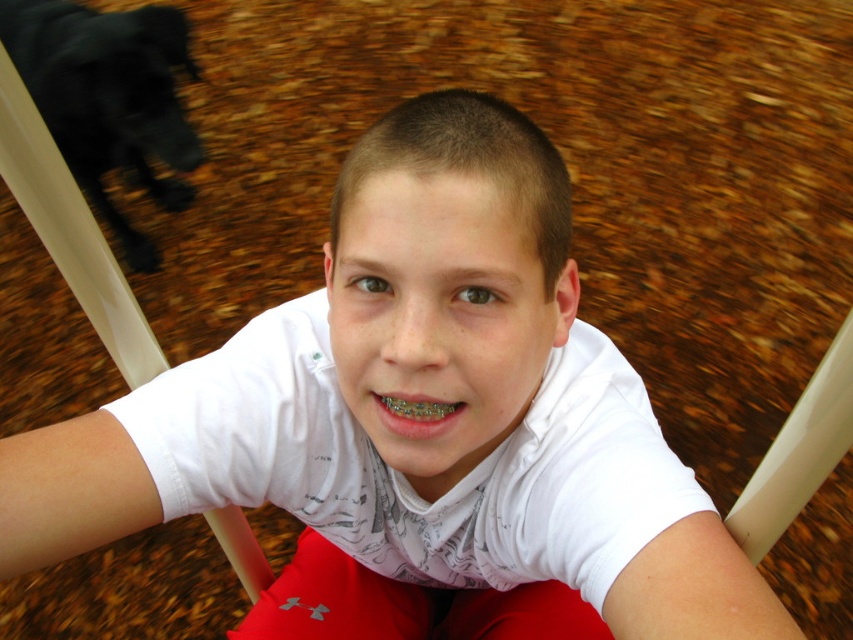
You are a photographer setting up a photo shoot. You have a camera that can focus on objects within a 1.5 meter range. You want to capture both the white cotton shirt at center and the black fur dog at upper left in the same clear shot. Is this possible?

The white cotton shirt at center and the black fur dog at upper left are 1.76 meters apart. Since the camera can only focus within 1.5 meters, the distance between them exceeds the camera range, so both cannot be in focus simultaneously.

You are standing in the room and see two points marked in the image. Which point is closer to you, point [595,426] or point [136,61]?

Point [595,426] is in front of point [136,61], so it is closer to you.